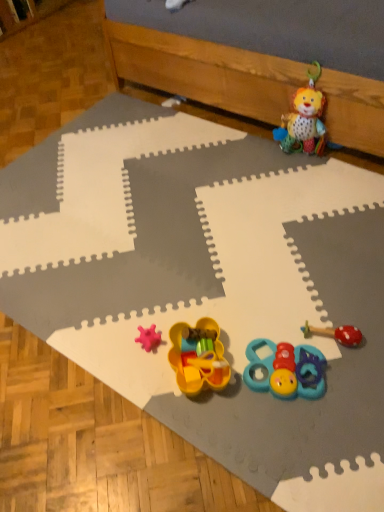
You are a GUI agent. You are given a task and a screenshot of the screen. Output one action in this format:
    pyautogui.click(x=<x>, y=<y>)
    Task: Click on the vacant space behind red rubber teething ring at lower right, the third toy when ordered from front to back
    
    Given the screenshot: What is the action you would take?
    pyautogui.click(x=318, y=285)